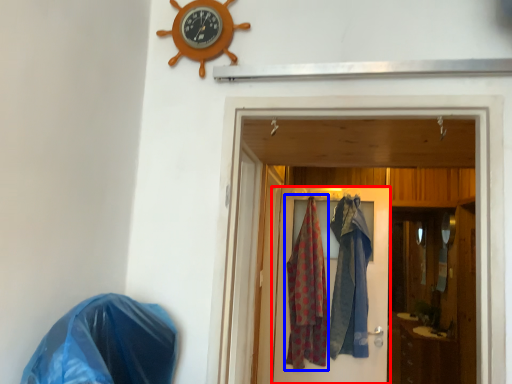
Question: Among these objects, which one is farthest to the camera, door (highlighted by a red box) or clothing (highlighted by a blue box)?

Choices:
 (A) door
 (B) clothing

Answer: (B)